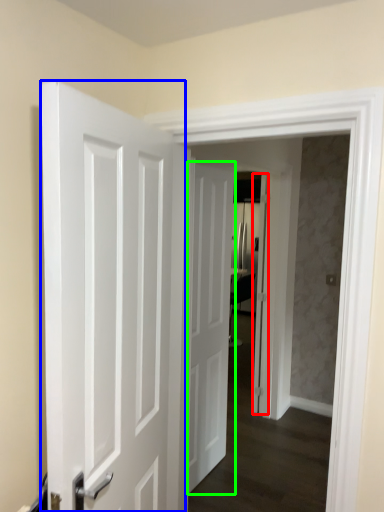
Question: Based on their relative distances, which object is farther from door (highlighted by a red box)? Choose from door (highlighted by a blue box) and door (highlighted by a green box).

Choices:
 (A) door
 (B) door

Answer: (A)